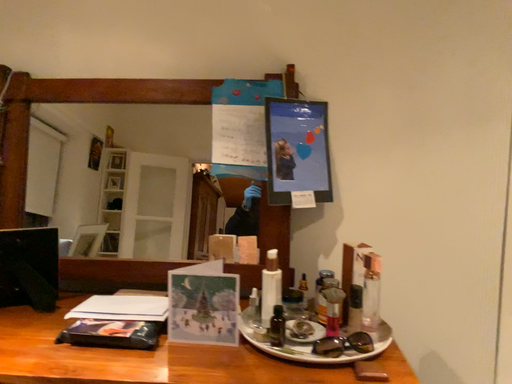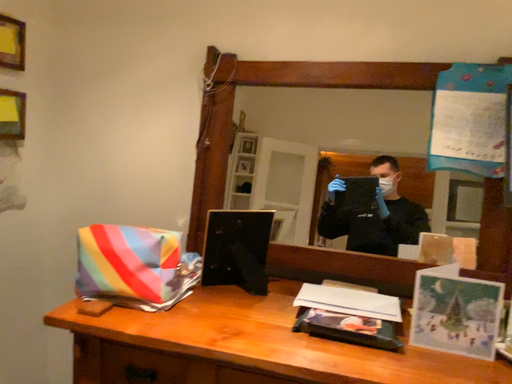
Question: Which way did the camera rotate in the video?

Choices:
 (A) rotated left
 (B) rotated right

Answer: (A)